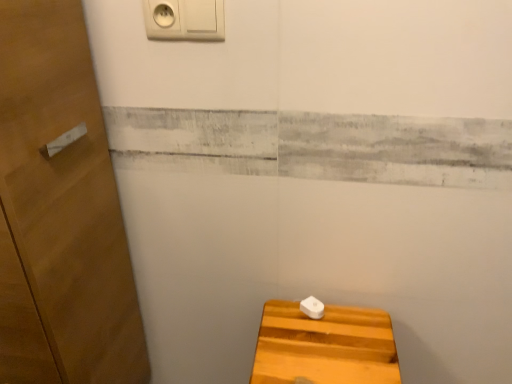
Question: Considering the relative sizes of white plastic knob at lower center and wooden door at left in the image provided, is white plastic knob at lower center smaller than wooden door at left?

Choices:
 (A) no
 (B) yes

Answer: (B)

Question: Is white plastic knob at lower center aimed at wooden door at left?

Choices:
 (A) no
 (B) yes

Answer: (A)

Question: From a real-world perspective, is white plastic knob at lower center over wooden door at left?

Choices:
 (A) yes
 (B) no

Answer: (B)

Question: Does white plastic knob at lower center have a greater height compared to wooden door at left?

Choices:
 (A) no
 (B) yes

Answer: (A)

Question: Does white plastic knob at lower center have a larger size compared to wooden door at left?

Choices:
 (A) no
 (B) yes

Answer: (A)

Question: Is white plastic knob at lower center located outside wooden door at left?

Choices:
 (A) yes
 (B) no

Answer: (A)

Question: Can you confirm if white plastic/light switch at upper center is smaller than wooden door at left?

Choices:
 (A) yes
 (B) no

Answer: (A)

Question: Would you say white plastic/light switch at upper center is outside wooden door at left?

Choices:
 (A) no
 (B) yes

Answer: (B)

Question: Does white plastic/light switch at upper center lie behind wooden door at left?

Choices:
 (A) yes
 (B) no

Answer: (A)

Question: Does white plastic/light switch at upper center have a lesser height compared to wooden door at left?

Choices:
 (A) yes
 (B) no

Answer: (A)

Question: From a real-world perspective, is white plastic/light switch at upper center on top of wooden door at left?

Choices:
 (A) no
 (B) yes

Answer: (B)

Question: Are white plastic/light switch at upper center and wooden door at left far apart?

Choices:
 (A) yes
 (B) no

Answer: (B)

Question: From the image's perspective, is white plastic knob at lower center on top of light brown wooden stool at lower right?

Choices:
 (A) no
 (B) yes

Answer: (B)